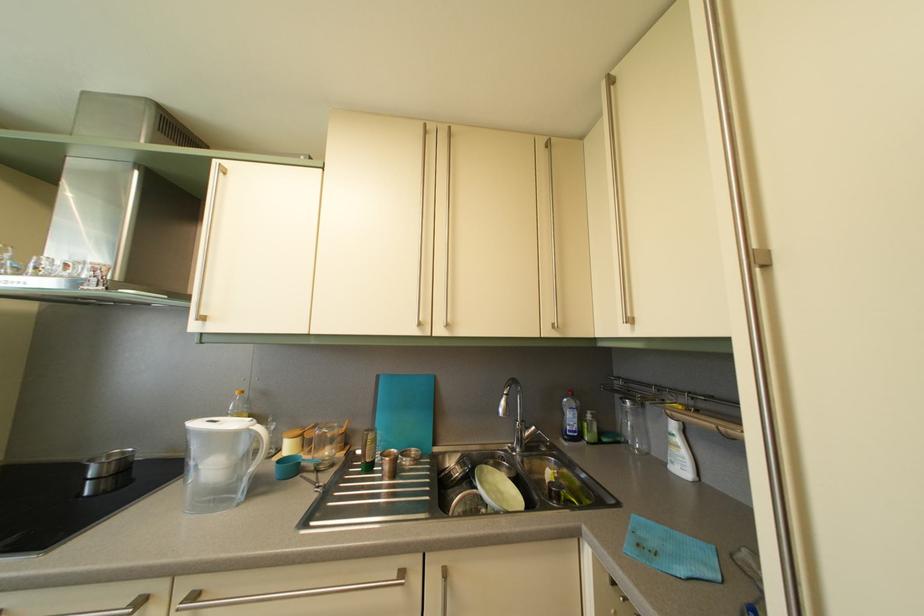
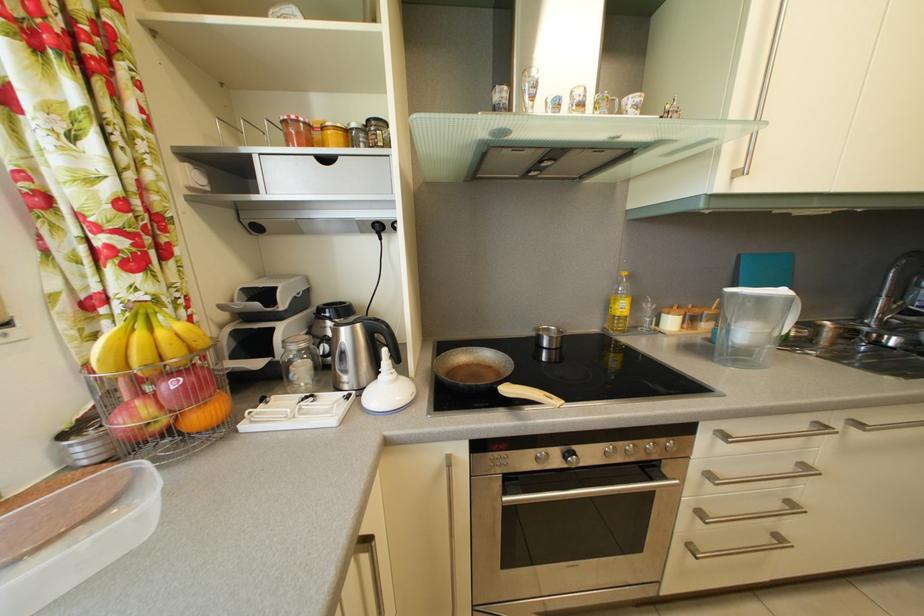
Question: The images are taken continuously from a first-person perspective. In which direction are you moving?

Choices:
 (A) Left
 (B) Right
 (C) Forward
 (D) Backward

Answer: (A)